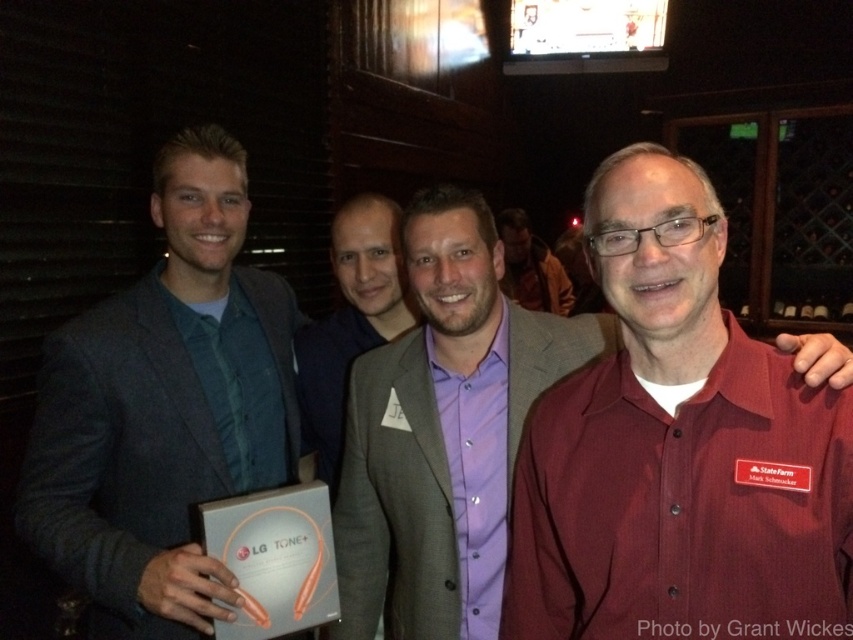
You are a photographer at the event and want to adjust your camera focus. Which of the two points, point (57,417) or point (492,500), is closer to the camera?

Point (57,417) is in front of point (492,500), so it is closer to the camera.

You are a photographer at a social event. You need to capture a closeup shot of the purple fabric shirt at center and the purple satin shirt at center. Your camera has a minimum focusing distance of 1.5 meters. Can you take the photo without moving either subject?

The distance between the purple fabric shirt at center and purple satin shirt at center is 2.09 meters, which is greater than the camera minimum focusing distance of 1.5 meters. Yes, you can take the photo without moving either subject.